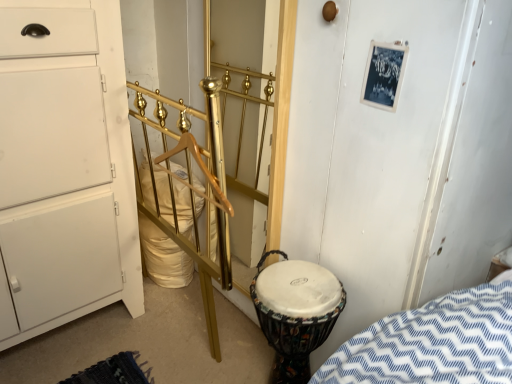
Question: Is multicolored fabric drum at lower right bigger than white matte chest of drawers at left?

Choices:
 (A) yes
 (B) no

Answer: (B)

Question: Is multicolored fabric drum at lower right to the right of white matte chest of drawers at left from the viewer's perspective?

Choices:
 (A) yes
 (B) no

Answer: (A)

Question: Is multicolored fabric drum at lower right looking in the opposite direction of white matte chest of drawers at left?

Choices:
 (A) no
 (B) yes

Answer: (A)

Question: Is multicolored fabric drum at lower right in front of white matte chest of drawers at left?

Choices:
 (A) no
 (B) yes

Answer: (A)

Question: Considering the relative sizes of multicolored fabric drum at lower right and white matte chest of drawers at left in the image provided, is multicolored fabric drum at lower right taller than white matte chest of drawers at left?

Choices:
 (A) no
 (B) yes

Answer: (A)

Question: Considering the relative sizes of multicolored fabric drum at lower right and white matte chest of drawers at left in the image provided, is multicolored fabric drum at lower right smaller than white matte chest of drawers at left?

Choices:
 (A) no
 (B) yes

Answer: (B)

Question: Is gold polished metal rail at center taller than gold metallic door at center?

Choices:
 (A) yes
 (B) no

Answer: (B)

Question: Does gold polished metal rail at center have a larger size compared to gold metallic door at center?

Choices:
 (A) no
 (B) yes

Answer: (B)

Question: Considering the relative positions of gold polished metal rail at center and gold metallic door at center in the image provided, is gold polished metal rail at center in front of gold metallic door at center?

Choices:
 (A) no
 (B) yes

Answer: (B)

Question: Does gold polished metal rail at center have a lesser height compared to gold metallic door at center?

Choices:
 (A) no
 (B) yes

Answer: (B)

Question: Is gold polished metal rail at center placed right next to gold metallic door at center?

Choices:
 (A) no
 (B) yes

Answer: (A)

Question: Considering the relative sizes of gold polished metal rail at center and gold metallic door at center in the image provided, is gold polished metal rail at center thinner than gold metallic door at center?

Choices:
 (A) no
 (B) yes

Answer: (A)

Question: Is gold metallic door at center wider than gold polished metal rail at center?

Choices:
 (A) no
 (B) yes

Answer: (A)